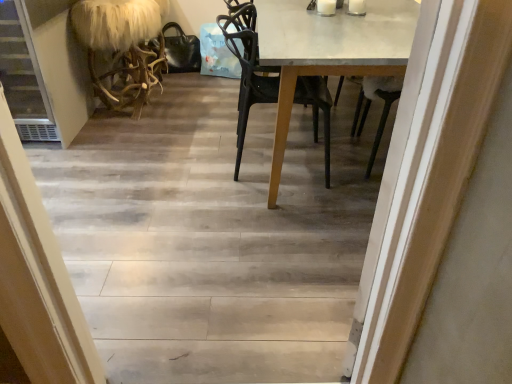
Where is `free space in front of black matte chair at center`? free space in front of black matte chair at center is located at coordinates (271, 213).